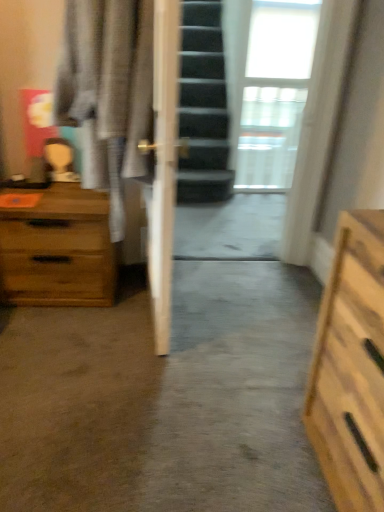
The height and width of the screenshot is (512, 384). Describe the element at coordinates (107, 91) in the screenshot. I see `light gray fabric robe at left` at that location.

Measure the distance between point [63,300] and camera.

The distance of point [63,300] from camera is 1.91 meters.

This screenshot has height=512, width=384. What do you see at coordinates (58, 250) in the screenshot? I see `wooden chest of drawers at left` at bounding box center [58, 250].

Find the location of `transparent glass door at center`. transparent glass door at center is located at coordinates (241, 122).

Identify the location of light gray fabric robe at left. (107, 91).

From a real-world perspective, is light gray fabric robe at left under transparent glass door at center?

No, from a real-world perspective, light gray fabric robe at left is not below transparent glass door at center.

Consider the image. Is light gray fabric robe at left not close to transparent glass door at center?

Absolutely, light gray fabric robe at left is distant from transparent glass door at center.

Is point (132, 177) farther from viewer compared to point (211, 127)?

That is False.

Looking at their sizes, would you say wooden chest of drawers at left is wider or thinner than transparent glass door at center?

wooden chest of drawers at left is wider than transparent glass door at center.

Does wooden chest of drawers at left appear on the right side of transparent glass door at center?

In fact, wooden chest of drawers at left is to the left of transparent glass door at center.

Between wooden chest of drawers at left and transparent glass door at center, which one has larger size?

wooden chest of drawers at left.

Based on the photo, how many degrees apart are the facing directions of wooden chest of drawers at left and transparent glass door at center?

The angle between the facing direction of wooden chest of drawers at left and the facing direction of transparent glass door at center is 1.49 degrees.

Looking at this image, is white sheer curtain at upper right located within wooden chest of drawers at left?

No, white sheer curtain at upper right is not surrounded by wooden chest of drawers at left.

From the picture: How many degrees apart are the facing directions of wooden chest of drawers at left and white sheer curtain at upper right?

The angle between the facing direction of wooden chest of drawers at left and the facing direction of white sheer curtain at upper right is 1.34 degrees.

Does wooden chest of drawers at left have a smaller size compared to white sheer curtain at upper right?

Indeed, wooden chest of drawers at left has a smaller size compared to white sheer curtain at upper right.

Considering the points (183, 243) and (16, 297), which point is behind, point (183, 243) or point (16, 297)?

The point (183, 243) is farther from the camera.

Considering the sizes of objects transparent glass door at center and wooden chest of drawers at left in the image provided, who is shorter, transparent glass door at center or wooden chest of drawers at left?

With less height is wooden chest of drawers at left.

Based on the photo, from a real-world perspective, is transparent glass door at center above or below wooden chest of drawers at left?

transparent glass door at center is above wooden chest of drawers at left.

From the image's perspective, relative to wooden chest of drawers at left, is transparent glass door at center above or below?

transparent glass door at center is situated higher than wooden chest of drawers at left in the image.

Which is closer to the camera, (257,138) or (58,298)?

The point (58,298) is closer to the camera.

Is white sheer curtain at upper right aimed at wooden chest of drawers at left?

No, white sheer curtain at upper right is not facing towards wooden chest of drawers at left.

How many degrees apart are the facing directions of white sheer curtain at upper right and wooden chest of drawers at left?

The angle between the facing direction of white sheer curtain at upper right and the facing direction of wooden chest of drawers at left is 1.34 degrees.

Is white sheer curtain at upper right far from wooden chest of drawers at left?

white sheer curtain at upper right is positioned a significant distance from wooden chest of drawers at left.

Considering the positions of point (244, 125) and point (116, 16), is point (244, 125) closer or farther from the camera than point (116, 16)?

Point (244, 125).

How much distance is there between transparent glass door at center and light gray fabric robe at left?

transparent glass door at center is 5.71 feet from light gray fabric robe at left.

Is the depth of transparent glass door at center greater than that of light gray fabric robe at left?

Yes, it is behind light gray fabric robe at left.

What's the angular difference between transparent glass door at center and light gray fabric robe at left's facing directions?

transparent glass door at center and light gray fabric robe at left are facing 85.1 degrees away from each other.

From the image's perspective, between white sheer curtain at upper right and transparent glass door at center, which one is located above?

white sheer curtain at upper right is shown above in the image.

Considering the relative sizes of white sheer curtain at upper right and transparent glass door at center in the image provided, is white sheer curtain at upper right thinner than transparent glass door at center?

In fact, white sheer curtain at upper right might be wider than transparent glass door at center.

Which object is positioned more to the left, white sheer curtain at upper right or transparent glass door at center?

transparent glass door at center.

Could you tell me if white sheer curtain at upper right is facing transparent glass door at center?

No, white sheer curtain at upper right does not turn towards transparent glass door at center.

You are a GUI agent. You are given a task and a screenshot of the screen. Output one action in this format:
    pyautogui.click(x=<x>, y=<y>)
    Task: Click on the glass door that appears on the right of light gray fabric robe at left
    The width and height of the screenshot is (384, 512).
    Given the screenshot: What is the action you would take?
    pyautogui.click(x=241, y=122)

Locate an element on the screen. glass door above the wooden chest of drawers at left (from a real-world perspective) is located at coordinates (241, 122).

Estimate the real-world distances between objects in this image. Which object is closer to transparent glass door at center, light gray fabric robe at left or wooden chest of drawers at left?

Among the two, wooden chest of drawers at left is located nearer to transparent glass door at center.

Which object lies nearer to the anchor point white sheer curtain at upper right, light gray fabric robe at left or wooden chest of drawers at left?

Based on the image, wooden chest of drawers at left appears to be nearer to white sheer curtain at upper right.

When comparing their distances from wooden chest of drawers at left, does transparent glass door at center or white sheer curtain at upper right seem further?

The object further to wooden chest of drawers at left is white sheer curtain at upper right.

Which object lies further to the anchor point wooden chest of drawers at left, transparent glass door at center or light gray fabric robe at left?

transparent glass door at center is further to wooden chest of drawers at left.

Consider the image. Estimate the real-world distances between objects in this image. Which object is closer to transparent glass door at center, white sheer curtain at upper right or wooden chest of drawers at left?

white sheer curtain at upper right.

Looking at the image, which one is located further to transparent glass door at center, wooden chest of drawers at left or white sheer curtain at upper right?

Based on the image, wooden chest of drawers at left appears to be further to transparent glass door at center.

Based on their spatial positions, is wooden chest of drawers at left or transparent glass door at center closer to white sheer curtain at upper right?

transparent glass door at center is positioned closer to the anchor white sheer curtain at upper right.

Based on their spatial positions, is white sheer curtain at upper right or transparent glass door at center further from light gray fabric robe at left?

white sheer curtain at upper right.

Locate an element on the screen. The width and height of the screenshot is (384, 512). glass door between light gray fabric robe at left and white sheer curtain at upper right from front to back is located at coordinates (241, 122).

Where is `glass door between wooden chest of drawers at left and white sheer curtain at upper right along the z-axis`? glass door between wooden chest of drawers at left and white sheer curtain at upper right along the z-axis is located at coordinates (241, 122).

Where is `the chest of drawers positioned between light gray fabric robe at left and white sheer curtain at upper right from near to far`? the chest of drawers positioned between light gray fabric robe at left and white sheer curtain at upper right from near to far is located at coordinates (58, 250).

Identify the location of robe between wooden chest of drawers at left and transparent glass door at center. (107, 91).